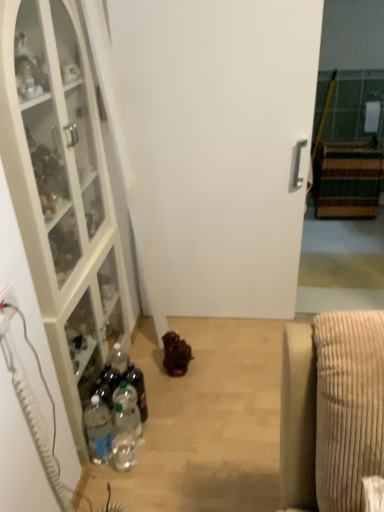
Identify the location of free space between white matte door at center and clear plastic bottle at lower left, marked as the second bottle in a right-to-left arrangement. The height and width of the screenshot is (512, 384). (204, 357).